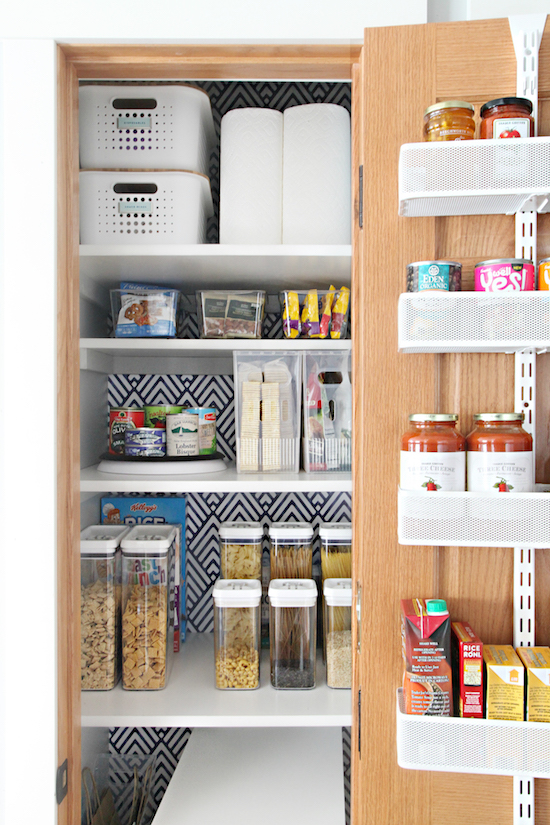
Find the location of `glass`. glass is located at coordinates (428, 446), (510, 449), (453, 124), (505, 114).